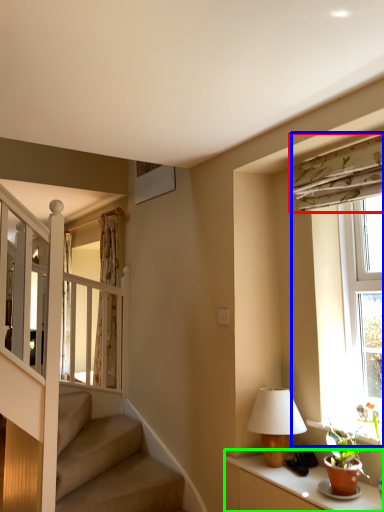
Question: Which is nearer to the curtain (highlighted by a red box)? window (highlighted by a blue box) or table (highlighted by a green box).

Choices:
 (A) window
 (B) table

Answer: (A)